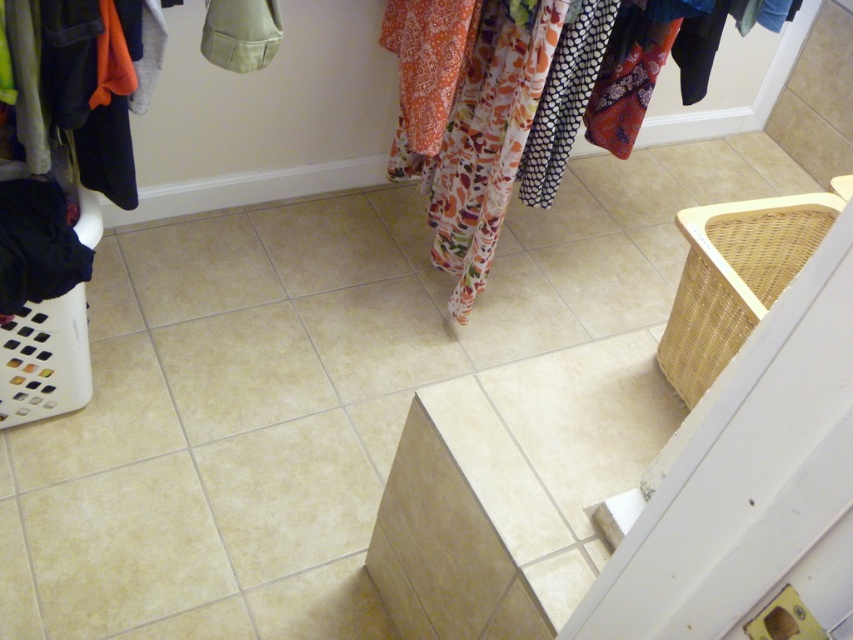
Which is more to the right, matte black pants at left or woven beige laundry basket at right?

From the viewer's perspective, woven beige laundry basket at right appears more on the right side.

Does matte black pants at left have a larger size compared to woven beige laundry basket at right?

No.

The width and height of the screenshot is (853, 640). What do you see at coordinates (88, 83) in the screenshot?
I see `matte black pants at left` at bounding box center [88, 83].

Where is `matte black pants at left`? This screenshot has height=640, width=853. matte black pants at left is located at coordinates (88, 83).

In the scene shown: Can you confirm if floral fabric clothes at upper center is smaller than white plastic laundry basket at lower left?

Incorrect, floral fabric clothes at upper center is not smaller in size than white plastic laundry basket at lower left.

Between point (492, 205) and point (28, 388), which one is positioned behind?

Point (492, 205)

Identify the location of floral fabric clothes at upper center. [466, 122].

Consider the image. Is woven beige laundry basket at right closer to the viewer compared to white plastic laundry basket at lower left?

Yes, woven beige laundry basket at right is closer to the viewer.

Who is higher up, woven beige laundry basket at right or white plastic laundry basket at lower left?

Positioned higher is woven beige laundry basket at right.

Does point (698, 374) lie in front of point (27, 385)?

Yes.

Where is `woven beige laundry basket at right`? woven beige laundry basket at right is located at coordinates (734, 278).